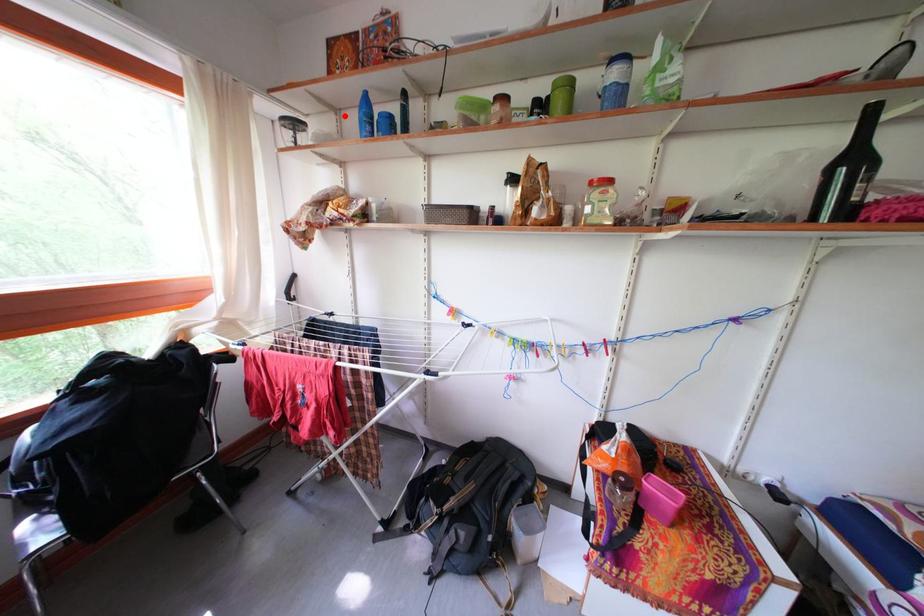
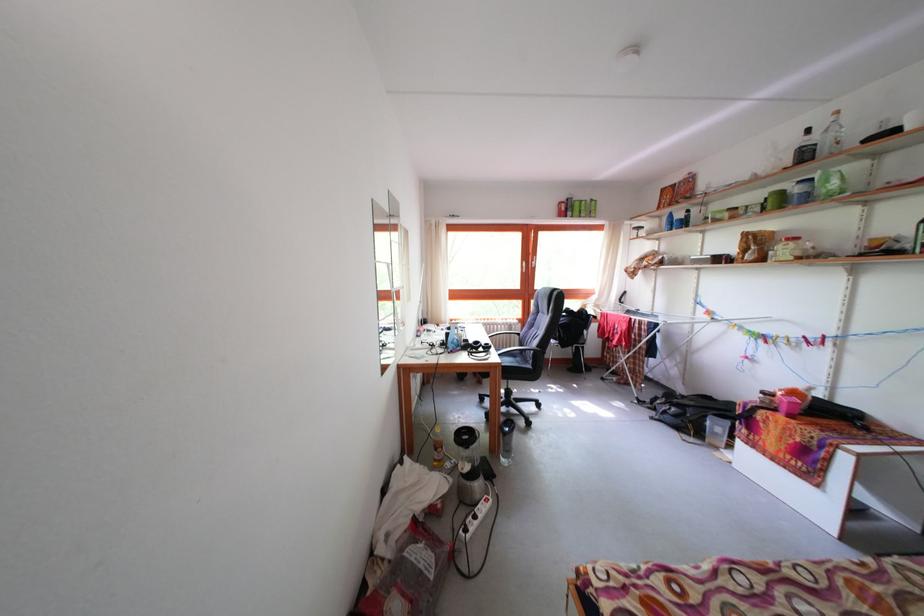
Locate, in the second image, the point that corresponds to the highlighted location in the first image.

(667, 224)